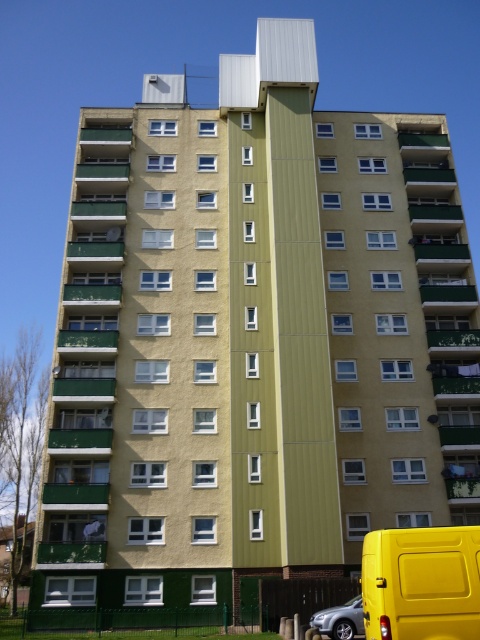
Can you confirm if yellow matte van at lower right is smaller than silver metallic car at lower center?

Actually, yellow matte van at lower right might be larger than silver metallic car at lower center.

Which is in front, point (470, 573) or point (322, 630)?

Positioned in front is point (470, 573).

Where is `yellow matte van at lower right`? This screenshot has width=480, height=640. yellow matte van at lower right is located at coordinates pyautogui.click(x=421, y=582).